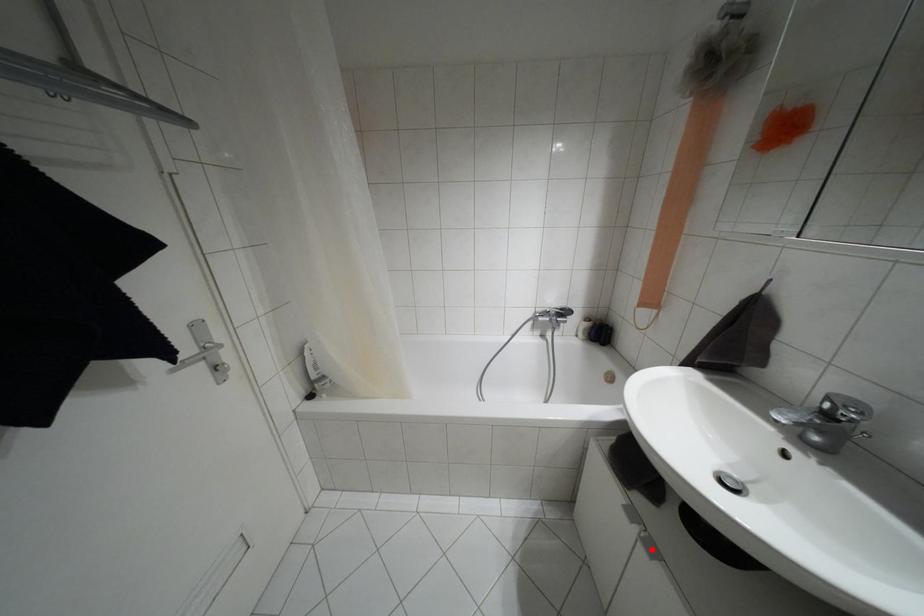
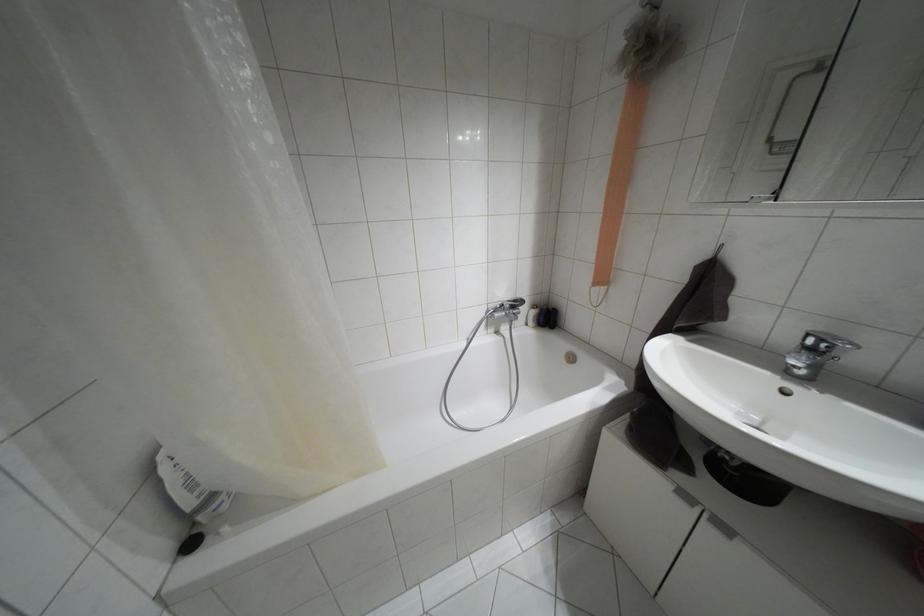
In the second image, find the point that corresponds to the highlighted location in the first image.

(723, 528)